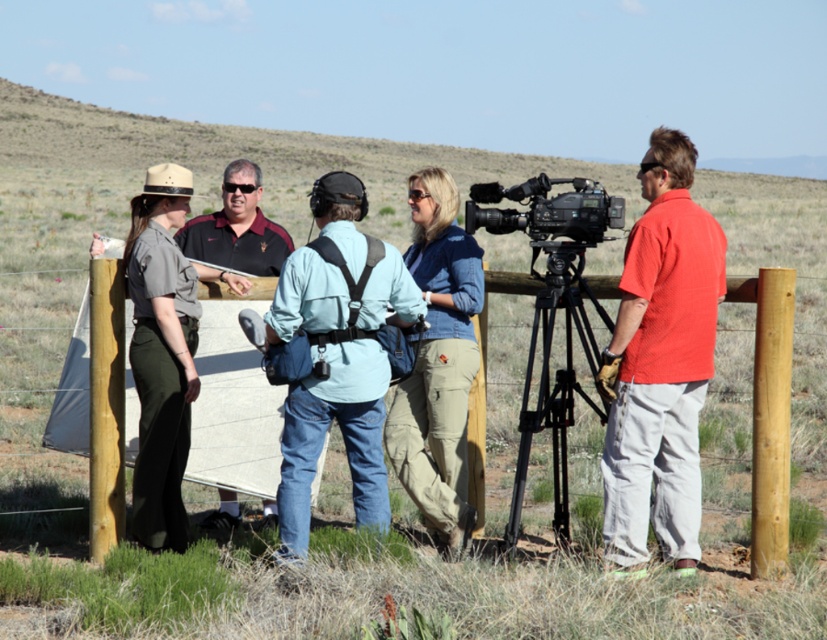
You are a photographer trying to capture a clear shot of the denim jacket at center and the wooden fence at center. Given their sizes, which object would require you to move closer to ensure it appears large enough in the frame?

The denim jacket at center has a smaller size compared to the wooden fence at center, so you would need to move closer to the denim jacket at center to ensure it appears large enough in the frame.

You are a photographer standing behind the fence in the image. You want to capture a photo that includes both the red cotton shirt at right and the brown wood post at left. Based on their positions, which object should you adjust your camera angle to include first?

The red cotton shirt at right is to the right of the brown wood post at left. To include both in the photo, you should adjust your camera angle to first include the brown wood post at left since it is positioned to the left of the red cotton shirt at right.

In the scene shown: You are a camera operator preparing to set up your equipment. You notice the black metal tripod at center and the matte black shirt at center in the scene. Which object is positioned lower relative to the other?

The black metal tripod at center is located below the matte black shirt at center, so the tripod is positioned lower than the shirt.